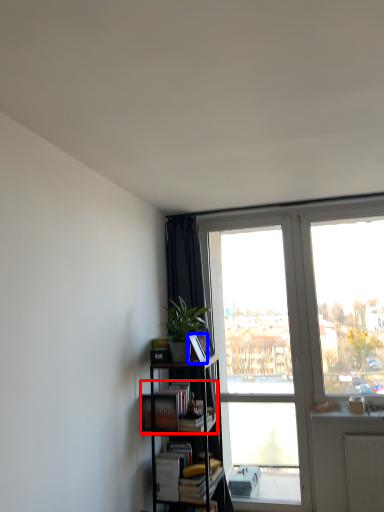
Question: Among these objects, which one is farthest to the camera, book (highlighted by a red box) or paperback book (highlighted by a blue box)?

Choices:
 (A) book
 (B) paperback book

Answer: (B)